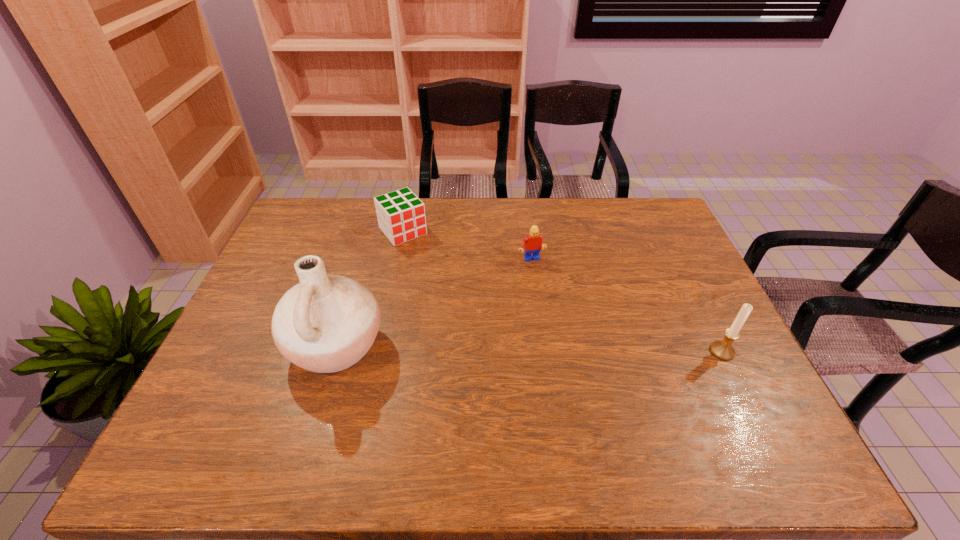
Find the location of a particular element. Image resolution: width=960 pixels, height=540 pixels. vacant space on the desktop that is between the tallest object and the candle holder and is positioned on the front-facing side of the third object from left to right is located at coordinates (569, 349).

You are a GUI agent. You are given a task and a screenshot of the screen. Output one action in this format:
    pyautogui.click(x=<x>, y=<y>)
    Task: Click on the free spot on the desktop that is between the pottery and the rightmost object and is positioned on the red face of the cube
    This screenshot has height=540, width=960.
    Given the screenshot: What is the action you would take?
    pyautogui.click(x=504, y=348)